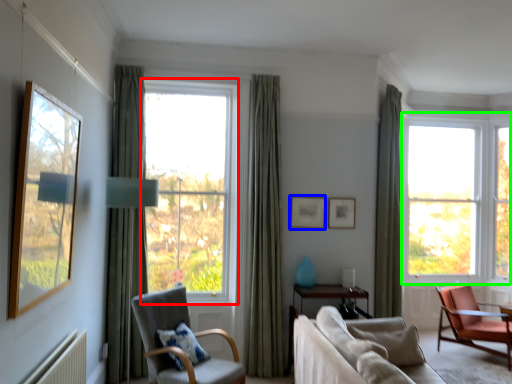
Question: Which object is positioned farthest from window (highlighted by a red box)? Select from picture frame (highlighted by a blue box) and window (highlighted by a green box).

Choices:
 (A) picture frame
 (B) window

Answer: (B)